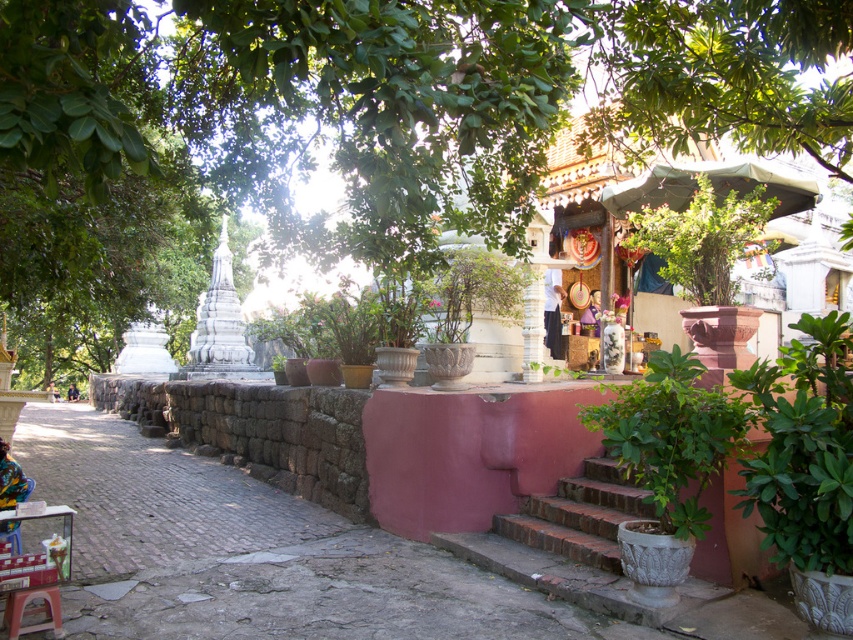
Question: Does green leafy tree at upper center lie in front of brick stairs at center?

Choices:
 (A) yes
 (B) no

Answer: (A)

Question: Among these points, which one is nearest to the camera?

Choices:
 (A) (363, 228)
 (B) (496, 532)

Answer: (A)

Question: In this image, where is green leafy tree at upper center located relative to brick stairs at center?

Choices:
 (A) above
 (B) below

Answer: (A)

Question: Which of the following is the closest to the observer?

Choices:
 (A) brick stairs at center
 (B) green leafy tree at upper center

Answer: (B)

Question: Can you confirm if green leafy tree at upper center is smaller than brick stairs at center?

Choices:
 (A) no
 (B) yes

Answer: (A)